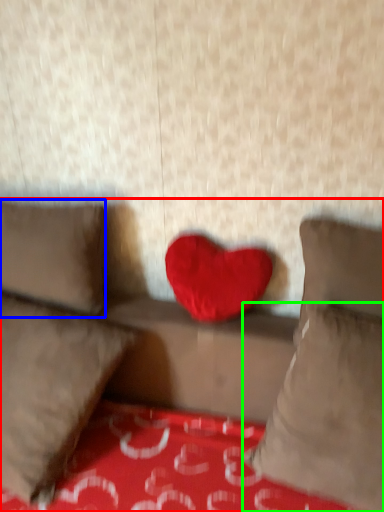
Question: Estimate the real-world distances between objects in this image. Which object is farther from studio couch (highlighted by a red box), pillow (highlighted by a blue box) or pillow (highlighted by a green box)?

Choices:
 (A) pillow
 (B) pillow

Answer: (B)